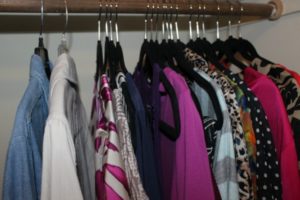
At what (x,y) coordinates should I click in order to perform the action: click on closet. Please return your answer as a coordinate pair (x, y). This screenshot has width=300, height=200. Looking at the image, I should click on (22, 65).